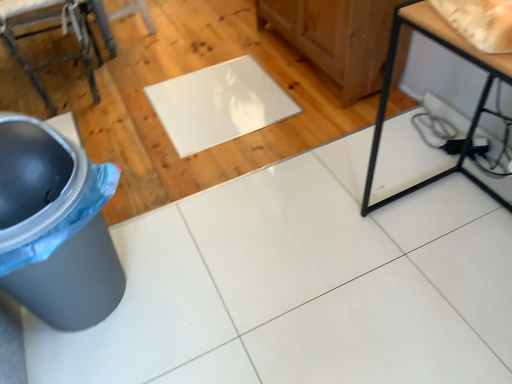
Question: Considering their positions, is black metal table at lower right located in front of or behind glossy white mat at center?

Choices:
 (A) behind
 (B) front

Answer: (B)

Question: Visually, is black metal table at lower right positioned to the left or to the right of glossy white mat at center?

Choices:
 (A) right
 (B) left

Answer: (A)

Question: Estimate the real-world distances between objects in this image. Which object is closer to the black metal table at lower right?

Choices:
 (A) glossy white mat at center
 (B) metallic gray stool at upper left
 (C) gray plastic trash can at lower left

Answer: (A)

Question: Considering the real-world distances, which object is closest to the glossy white mat at center?

Choices:
 (A) metallic gray stool at upper left
 (B) black metal table at lower right
 (C) gray plastic trash can at lower left

Answer: (A)